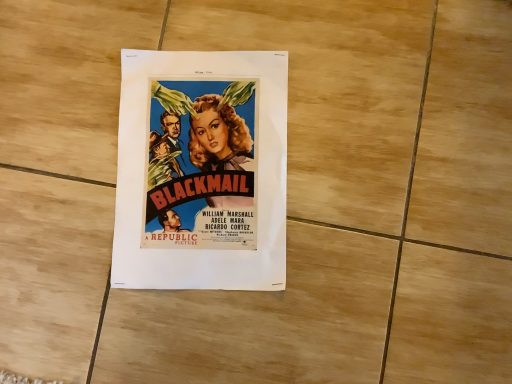
This screenshot has width=512, height=384. I want to click on free space above matte paper poster at center (from a real-world perspective), so click(198, 168).